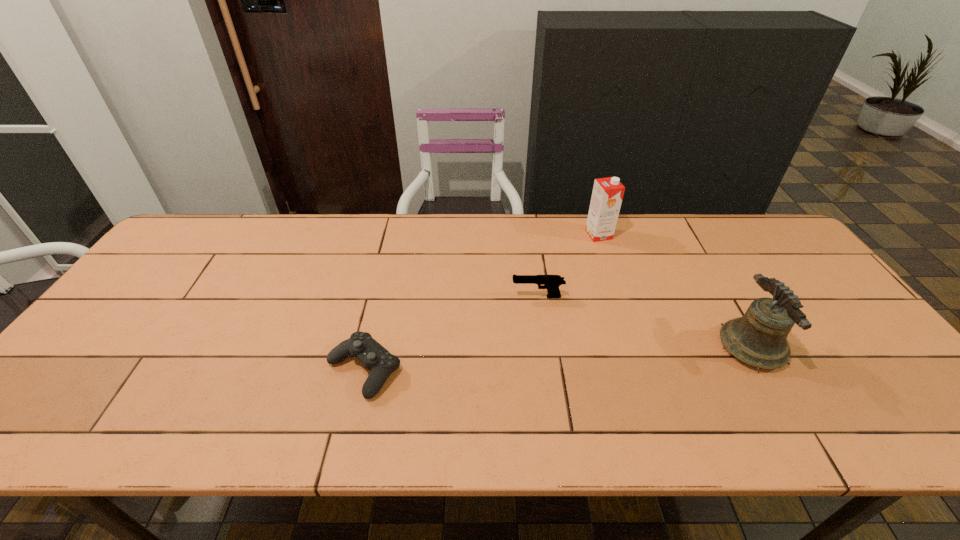
Identify the location of vacant position in the image that satisfies the following two spatial constraints: 1. on the front side of the carton; 2. on the front-facing side of the pistol. (619, 296).

You are a GUI agent. You are given a task and a screenshot of the screen. Output one action in this format:
    pyautogui.click(x=<x>, y=<y>)
    Task: Click on the free space that satisfies the following two spatial constraints: 1. on the front-facing side of the rightmost object; 2. on the left side of the third tallest object
    This screenshot has height=540, width=960.
    Given the screenshot: What is the action you would take?
    pyautogui.click(x=544, y=347)

This screenshot has height=540, width=960. I want to click on free point that satisfies the following two spatial constraints: 1. on the front-facing side of the second object from left to right; 2. on the right side of the rightmost object, so click(544, 347).

Image resolution: width=960 pixels, height=540 pixels. What are the coordinates of `free space that satisfies the following two spatial constraints: 1. on the front-facing side of the pistol; 2. on the back side of the rightmost object` in the screenshot? It's located at (544, 347).

Locate an element on the screen. Image resolution: width=960 pixels, height=540 pixels. free space that satisfies the following two spatial constraints: 1. on the front side of the carton; 2. on the front-facing side of the second shortest object is located at coordinates (619, 296).